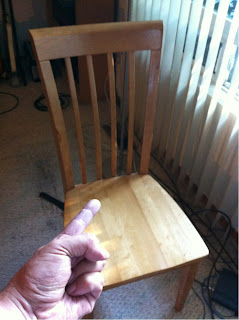
Image resolution: width=239 pixels, height=320 pixels. I want to click on chair, so click(121, 217).